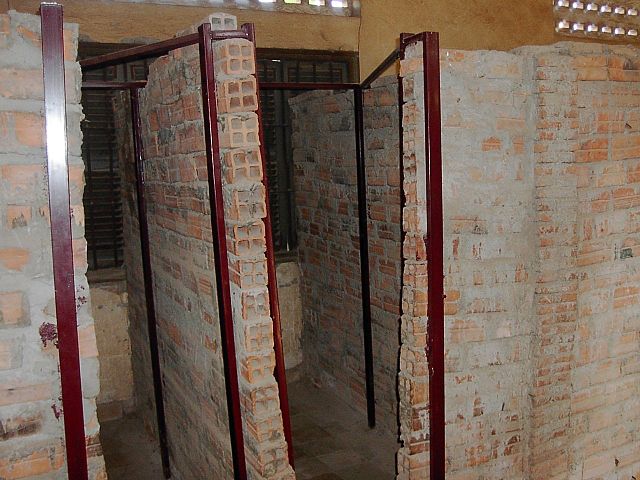
Locate an element on the screen. The image size is (640, 480). brown wall is located at coordinates (463, 22), (116, 22).